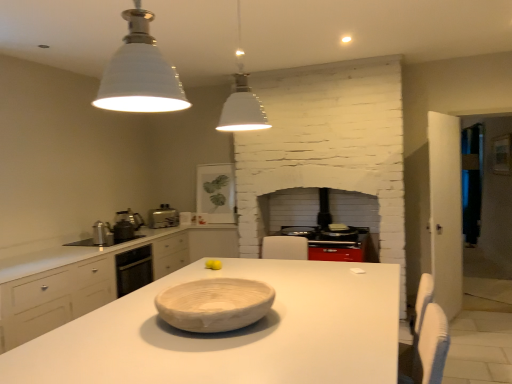
You are a GUI agent. You are given a task and a screenshot of the screen. Output one action in this format:
    pyautogui.click(x=<x>, y=<y>)
    Task: Click on the free space below white ceramic light fixture at upper center, which appears as the first light fixture when viewed from the front (from a real-world perspective)
    This screenshot has height=384, width=512.
    Given the screenshot: What is the action you would take?
    pyautogui.click(x=160, y=373)